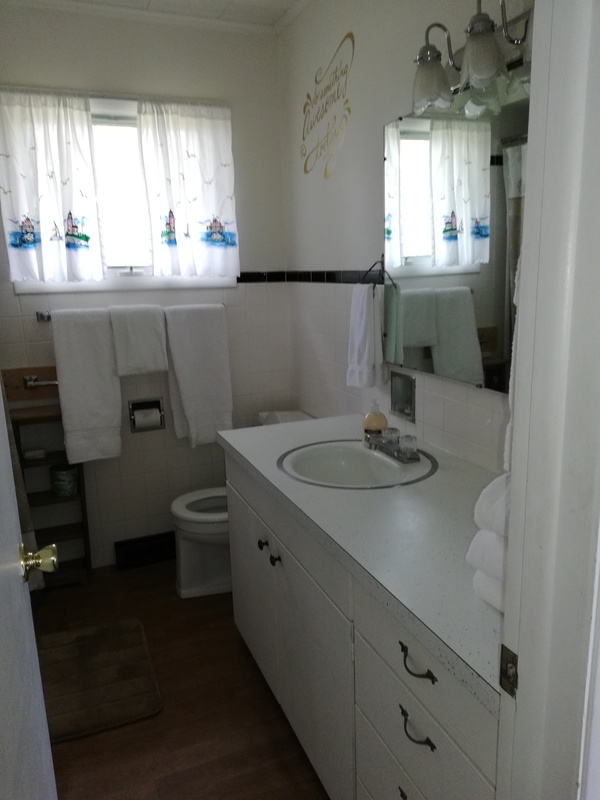
Where is `window in mirror`? window in mirror is located at coordinates (420, 206).